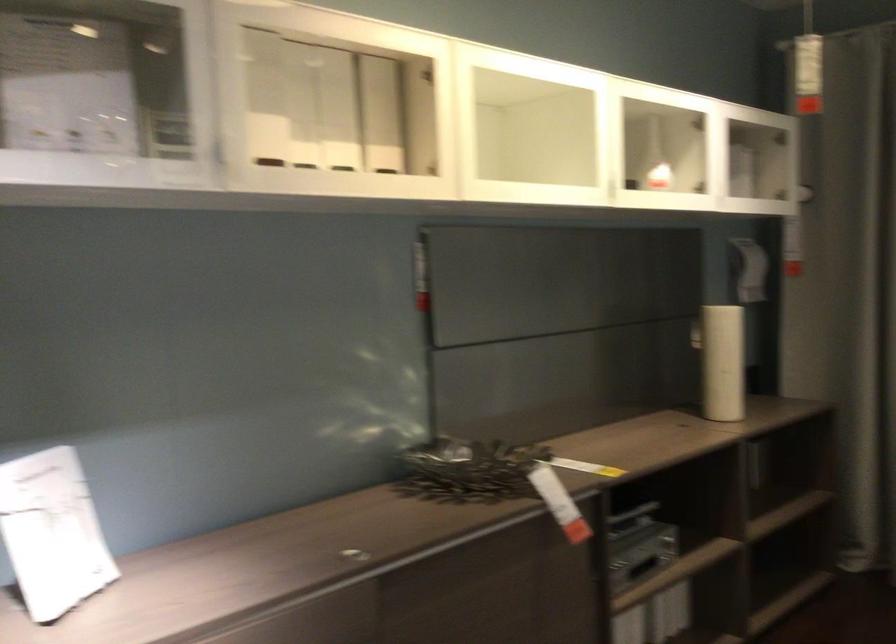
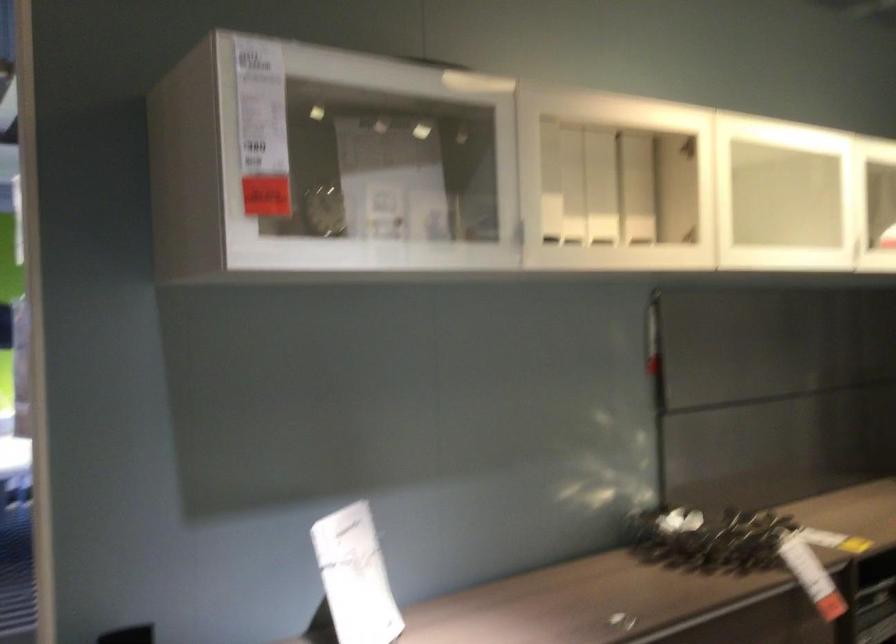
In the second image, find the point that corresponds to [383,115] in the first image.

(636, 187)